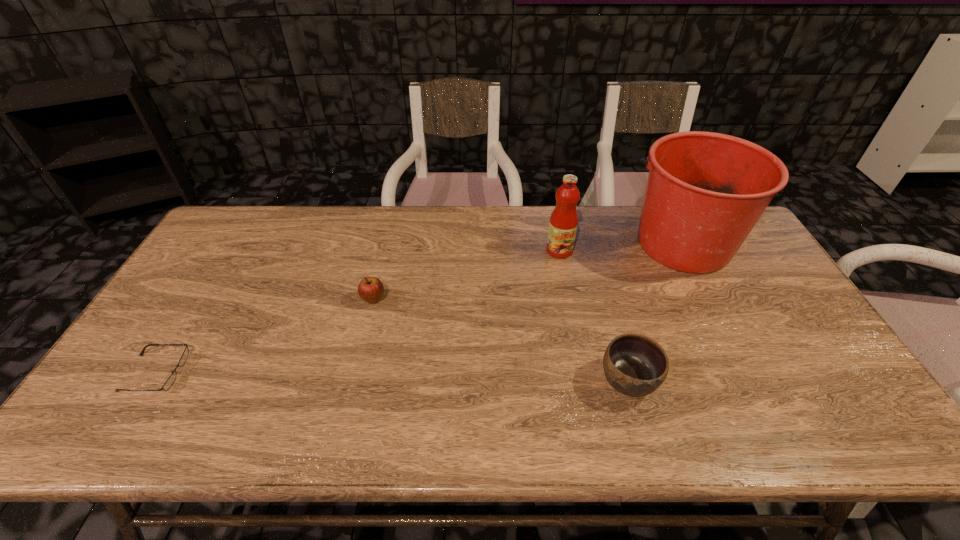
I want to click on free space at the far left corner of the desktop, so click(x=228, y=245).

Identify the location of vacant point located between the bowl and the bucket. The image size is (960, 540). (656, 312).

Identify the location of empty space that is in between the third nearest object and the spectacles. Image resolution: width=960 pixels, height=540 pixels. pyautogui.click(x=264, y=336).

The width and height of the screenshot is (960, 540). Find the location of `empty space between the apple and the bucket`. empty space between the apple and the bucket is located at coordinates (529, 272).

Locate an element on the screen. free space between the fruit juice and the bowl is located at coordinates (593, 315).

Image resolution: width=960 pixels, height=540 pixels. I want to click on vacant area that lies between the third nearest object and the bucket, so click(x=529, y=272).

At what (x,y) coordinates should I click in order to perform the action: click on vacant space in between the bowl and the fruit juice. Please return your answer as a coordinate pair (x, y). The height and width of the screenshot is (540, 960). Looking at the image, I should click on (593, 315).

Where is `free point between the leftmost object and the third farthest object`? free point between the leftmost object and the third farthest object is located at coordinates (264, 336).

Locate an element on the screen. Image resolution: width=960 pixels, height=540 pixels. vacant area that lies between the bowl and the apple is located at coordinates (501, 340).

Locate an element on the screen. This screenshot has width=960, height=540. vacant area between the apple and the shortest object is located at coordinates (264, 336).